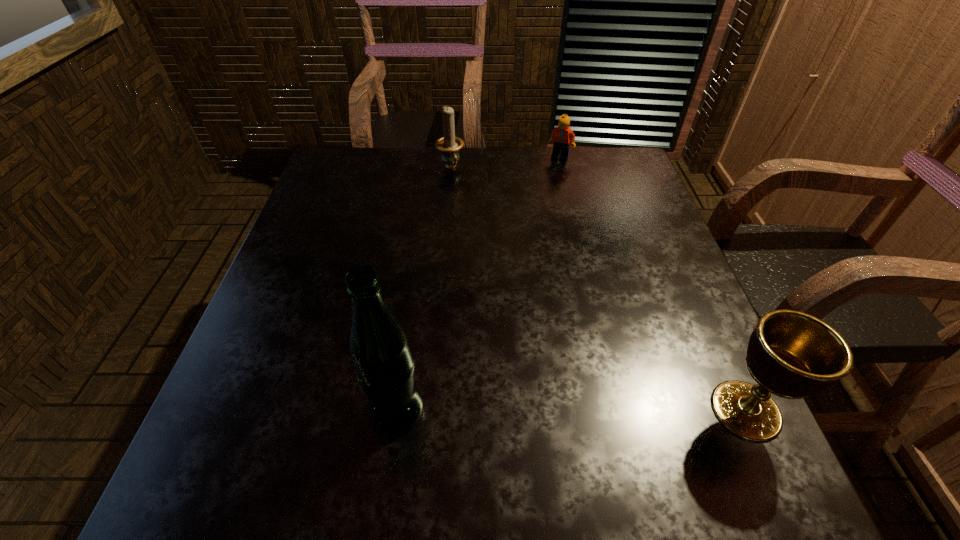
Locate an element on the screen. This screenshot has width=960, height=540. beer bottle is located at coordinates (384, 364).

This screenshot has width=960, height=540. I want to click on the rightmost object, so click(791, 354).

Where is `the shortest object`? This screenshot has height=540, width=960. the shortest object is located at coordinates (561, 136).

At what (x,y) coordinates should I click in order to perform the action: click on the third object from left to right. Please return your answer as a coordinate pair (x, y). The width and height of the screenshot is (960, 540). Looking at the image, I should click on (561, 136).

At what (x,y) coordinates should I click in order to perform the action: click on candle_holder. Please return your answer as a coordinate pair (x, y). The width and height of the screenshot is (960, 540). Looking at the image, I should click on (449, 145).

The image size is (960, 540). I want to click on blank area located on the left of the beer bottle, so click(x=282, y=410).

In order to click on free space located 0.320m on the back of the chalice in this screenshot , I will do `click(677, 258)`.

You are a GUI agent. You are given a task and a screenshot of the screen. Output one action in this format:
    pyautogui.click(x=<x>, y=<y>)
    Task: Click on the vacant area situated 0.090m on the front-facing side of the third object from left to right
    
    Given the screenshot: What is the action you would take?
    pyautogui.click(x=563, y=178)

This screenshot has width=960, height=540. Identify the location of free space located on the front-facing side of the third object from left to right. (568, 231).

The width and height of the screenshot is (960, 540). What are the coordinates of `free space located on the front-facing side of the third object from left to right` in the screenshot? It's located at (569, 239).